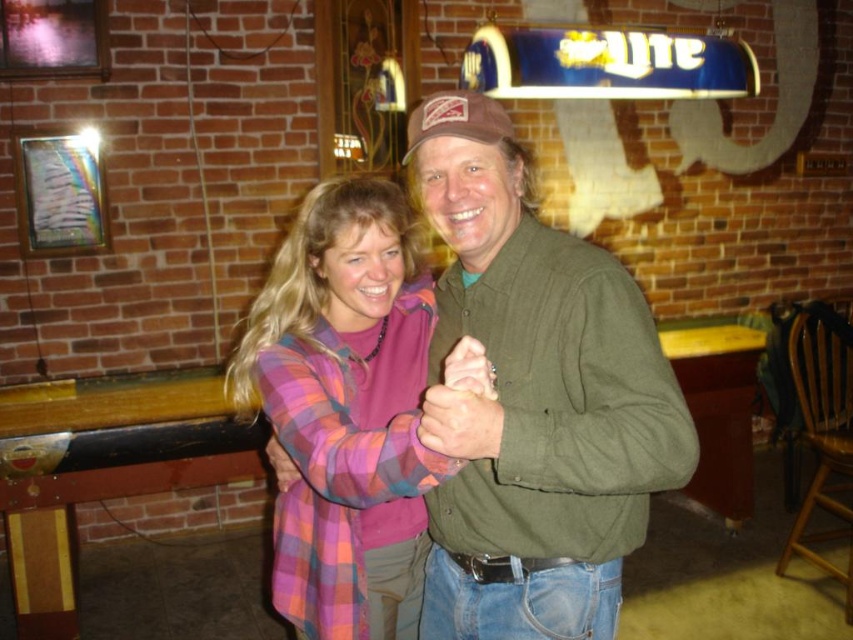
You are standing at the point with coordinates point (299,472) and want to move towards the pool table. There is an obstacle at point (456,390). Will you need to go around the obstacle?

Point (456,390) is in front of point (299,472), so you will need to go around the obstacle at point (456,390) to reach the pool table.

You are a photographer setting up for a group photo. You need to ensure that the matte brown ring at center and the matte plaid shirt at center are both clearly visible in the frame. Given that the camera has a maximum focus range of 50 centimeters, will you be able to capture both items in focus without adjusting the camera settings?

The matte brown ring at center is 60.28 centimeters away from the matte plaid shirt at center. Since the camera can only focus within 50 centimeters, the distance between them exceeds the focus range. Therefore, you will need to adjust the camera settings to ensure both items are in focus.

You are a photographer standing at the camera position. You want to place a decorative sticker exactly at the point marked as point (432, 422). The sticker has a diameter of 4 inches. Will the sticker cover the entire point without overlapping any nearby objects?

The distance of point (432, 422) from camera is 38.13 inches. Since the sticker is 4 inches in diameter, the photographer can place it there without overlapping nearby objects as there is sufficient space.